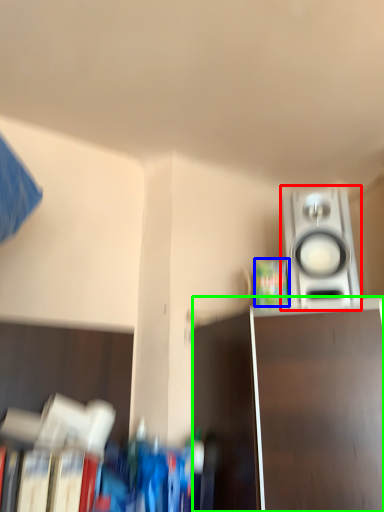
Question: Which object is the closest to the home appliance (highlighted by a red box)? Choose among these: paperback book (highlighted by a blue box) or furniture (highlighted by a green box).

Choices:
 (A) paperback book
 (B) furniture

Answer: (A)